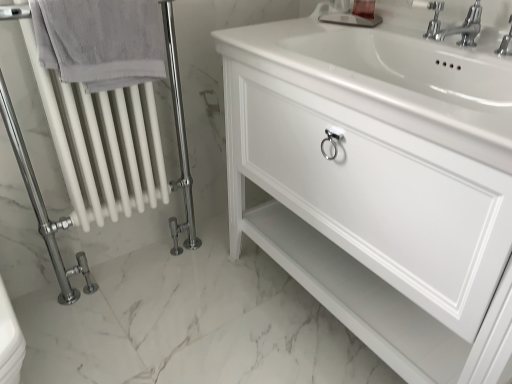
Question: Considering the relative positions of chrome metallic faucet at upper right and polished chrome faucet at upper right in the image provided, is chrome metallic faucet at upper right to the left of polished chrome faucet at upper right from the viewer's perspective?

Choices:
 (A) yes
 (B) no

Answer: (B)

Question: Considering the relative sizes of chrome metallic faucet at upper right and polished chrome faucet at upper right in the image provided, is chrome metallic faucet at upper right bigger than polished chrome faucet at upper right?

Choices:
 (A) no
 (B) yes

Answer: (B)

Question: Is chrome metallic faucet at upper right facing away from polished chrome faucet at upper right?

Choices:
 (A) no
 (B) yes

Answer: (A)

Question: From the image's perspective, would you say chrome metallic faucet at upper right is positioned over polished chrome faucet at upper right?

Choices:
 (A) no
 (B) yes

Answer: (A)

Question: Considering the relative sizes of chrome metallic faucet at upper right and polished chrome faucet at upper right in the image provided, is chrome metallic faucet at upper right thinner than polished chrome faucet at upper right?

Choices:
 (A) no
 (B) yes

Answer: (A)

Question: Relative to chrome metallic faucet at upper right, is gray cotton towel at left in front or behind?

Choices:
 (A) front
 (B) behind

Answer: (A)

Question: Is gray cotton towel at left to the left or to the right of chrome metallic faucet at upper right in the image?

Choices:
 (A) right
 (B) left

Answer: (B)

Question: Is point (111, 34) positioned closer to the camera than point (472, 6)?

Choices:
 (A) closer
 (B) farther

Answer: (A)

Question: From a real-world perspective, relative to chrome metallic faucet at upper right, is gray cotton towel at left vertically above or below?

Choices:
 (A) below
 (B) above

Answer: (A)

Question: Choose the correct answer: Is white glossy radiator at left inside white glossy cabinet at center or outside it?

Choices:
 (A) outside
 (B) inside

Answer: (A)

Question: Considering the positions of white glossy radiator at left and white glossy cabinet at center in the image, is white glossy radiator at left taller or shorter than white glossy cabinet at center?

Choices:
 (A) tall
 (B) short

Answer: (A)

Question: Is white glossy radiator at left to the left or to the right of white glossy cabinet at center in the image?

Choices:
 (A) right
 (B) left

Answer: (B)

Question: Looking at their shapes, would you say white glossy radiator at left is wider or thinner than white glossy cabinet at center?

Choices:
 (A) wide
 (B) thin

Answer: (B)

Question: From a real-world perspective, is polished chrome faucet at upper right physically located above or below white glossy radiator at left?

Choices:
 (A) above
 (B) below

Answer: (A)

Question: Considering the positions of point (436, 21) and point (67, 115), is point (436, 21) closer or farther from the camera than point (67, 115)?

Choices:
 (A) closer
 (B) farther

Answer: (A)